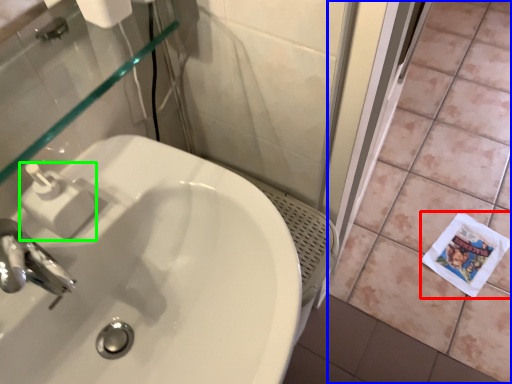
Question: Estimate the real-world distances between objects in this image. Which object is closer to paper (highlighted by a red box), ceramic tile (highlighted by a blue box) or soap dispenser (highlighted by a green box)?

Choices:
 (A) ceramic tile
 (B) soap dispenser

Answer: (A)